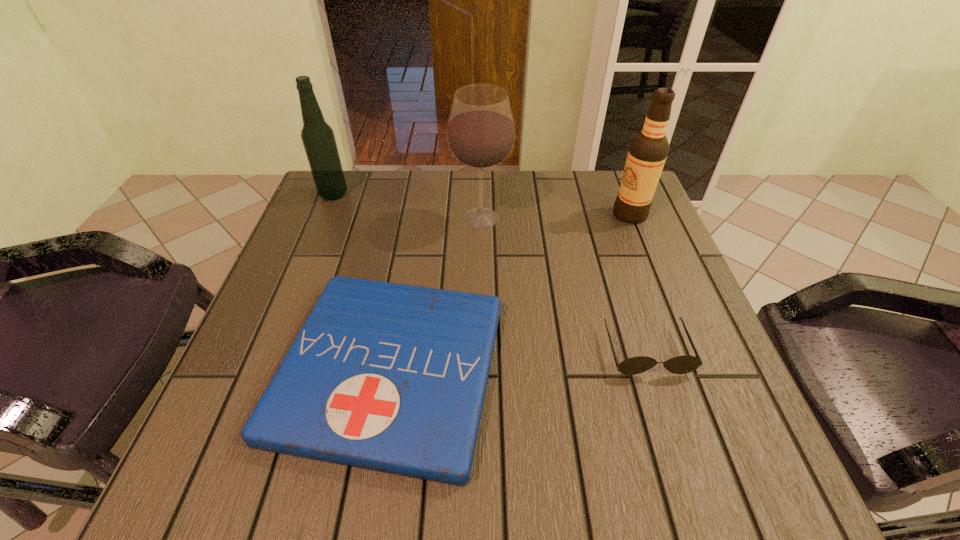
In the image, there is a desktop. Identify the location of free region at the far edge. (415, 195).

This screenshot has width=960, height=540. In order to click on free space at the near edge of the desktop in this screenshot , I will do `click(458, 487)`.

In the image, there is a desktop. Find the location of `free region at the left edge`. free region at the left edge is located at coordinates (297, 234).

The height and width of the screenshot is (540, 960). In order to click on vacant area at the right edge of the desktop in this screenshot , I will do `click(633, 356)`.

You are a GUI agent. You are given a task and a screenshot of the screen. Output one action in this format:
    pyautogui.click(x=<x>, y=<y>)
    Task: Click on the free space at the near left corner of the desktop
    Image resolution: width=960 pixels, height=540 pixels.
    Given the screenshot: What is the action you would take?
    pyautogui.click(x=232, y=443)

The width and height of the screenshot is (960, 540). I want to click on vacant space at the far right corner of the desktop, so click(591, 185).

In order to click on vacant space at the near right corner of the desktop in this screenshot , I will do `click(723, 458)`.

Identify the location of free spot between the leftmost alcohol and the second alcohol from left to right. This screenshot has width=960, height=540. (407, 206).

Identify the location of vacant region between the rightmost alcohol and the shortest object. The image size is (960, 540). (510, 292).

Where is `vacant area that lies between the first-aid kit and the fourth tallest object`? This screenshot has height=540, width=960. vacant area that lies between the first-aid kit and the fourth tallest object is located at coordinates (518, 360).